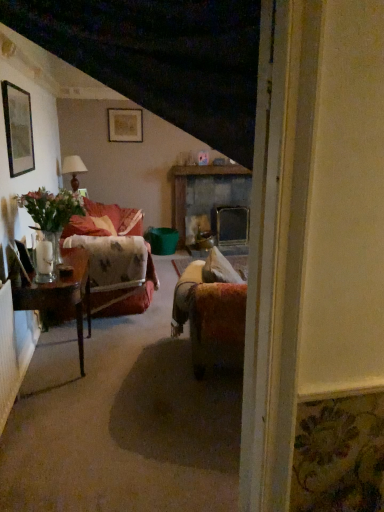
Question: From their relative heights in the image, would you say matte gold picture frame at upper center, which is the 2th picture frame from front to back, is taller or shorter than matte brown lamp at upper left?

Choices:
 (A) tall
 (B) short

Answer: (B)

Question: In the image, is matte gold picture frame at upper center, which ranks as the first picture frame in back-to-front order, positioned in front of or behind matte brown lamp at upper left?

Choices:
 (A) behind
 (B) front

Answer: (A)

Question: Which is nearer to the wooden glossy table at left?

Choices:
 (A) green matte picture frame at upper left, acting as the 1th picture frame starting from the front
 (B) velvet floral couch at left
 (C) rustic stone fireplace at center
 (D) matte gold picture frame at upper center, arranged as the 2th picture frame when ordered from the bottom
 (E) matte brown lamp at upper left

Answer: (B)

Question: Estimate the real-world distances between objects in this image. Which object is closer to the matte gold picture frame at upper center, which ranks as the first picture frame in back-to-front order?

Choices:
 (A) wooden glossy table at left
 (B) matte brown lamp at upper left
 (C) velvet floral couch at left
 (D) green matte picture frame at upper left, which is counted as the 2th picture frame, starting from the top
 (E) rustic stone fireplace at center

Answer: (B)